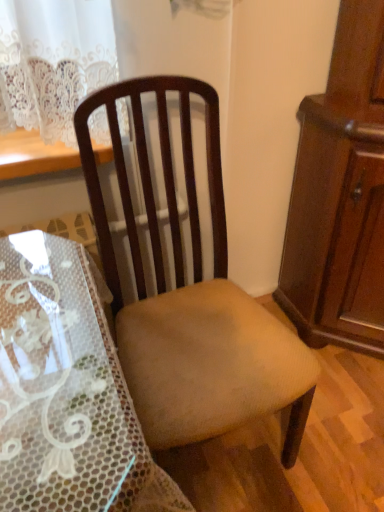
Question: Is mahogany wood cabinet at right positioned behind wooden chair at center?

Choices:
 (A) yes
 (B) no

Answer: (A)

Question: Can you confirm if mahogany wood cabinet at right is positioned to the left of wooden chair at center?

Choices:
 (A) no
 (B) yes

Answer: (A)

Question: Does mahogany wood cabinet at right have a greater height compared to wooden chair at center?

Choices:
 (A) yes
 (B) no

Answer: (A)

Question: From a real-world perspective, is mahogany wood cabinet at right over wooden chair at center?

Choices:
 (A) yes
 (B) no

Answer: (A)

Question: Is mahogany wood cabinet at right facing towards wooden chair at center?

Choices:
 (A) yes
 (B) no

Answer: (A)

Question: Is mahogany wood cabinet at right turned away from wooden chair at center?

Choices:
 (A) no
 (B) yes

Answer: (A)

Question: Would you consider wooden chair at center to be distant from mahogany wood cabinet at right?

Choices:
 (A) no
 (B) yes

Answer: (A)

Question: Is wooden chair at center positioned in front of mahogany wood cabinet at right?

Choices:
 (A) no
 (B) yes

Answer: (B)

Question: Is wooden chair at center in contact with mahogany wood cabinet at right?

Choices:
 (A) yes
 (B) no

Answer: (B)

Question: From the image's perspective, does wooden chair at center appear lower than mahogany wood cabinet at right?

Choices:
 (A) yes
 (B) no

Answer: (A)

Question: Is wooden chair at center at the left side of mahogany wood cabinet at right?

Choices:
 (A) no
 (B) yes

Answer: (B)

Question: From a real-world perspective, is wooden chair at center over mahogany wood cabinet at right?

Choices:
 (A) no
 (B) yes

Answer: (A)

Question: Is mahogany wood cabinet at right in front of or behind wooden chair at center in the image?

Choices:
 (A) front
 (B) behind

Answer: (B)